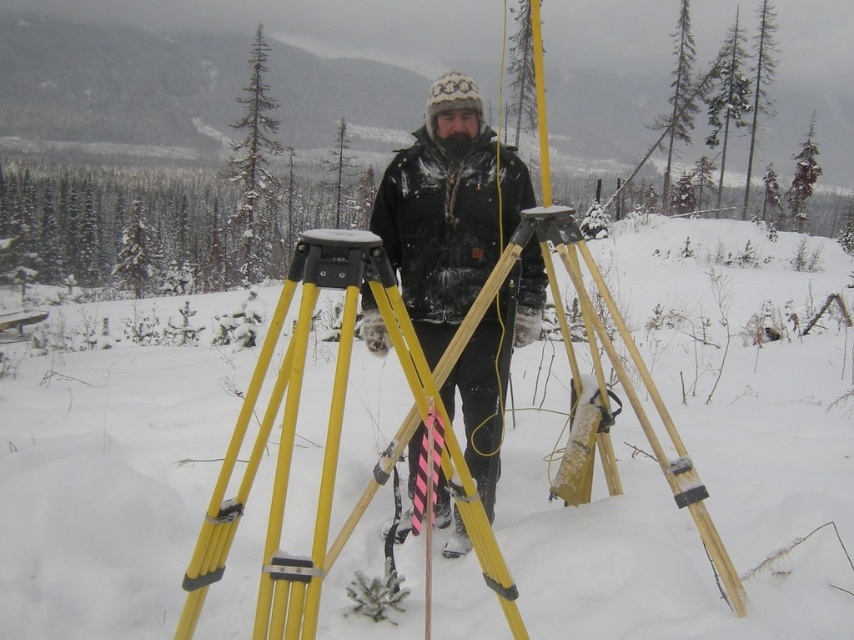
You are a hiker who wants to place a small flag on the highest point between the white matte snow at center and the black matte jacket at center. Which object should you choose to place the flag on?

The black matte jacket at center is taller than the white matte snow at center, so you should place the flag on the black matte jacket at center.

You are a fieldworker in the snowy forest scene. You need to place a small marker exactly where the white matte snow at center and black matte jacket at center are aligned horizontally. Which object should you use as your reference point to ensure the marker is placed correctly?

You should use the black matte jacket at center as your reference point because the white matte snow at center is to the right of it, so aligning the marker with the jacket ensures the correct horizontal placement.